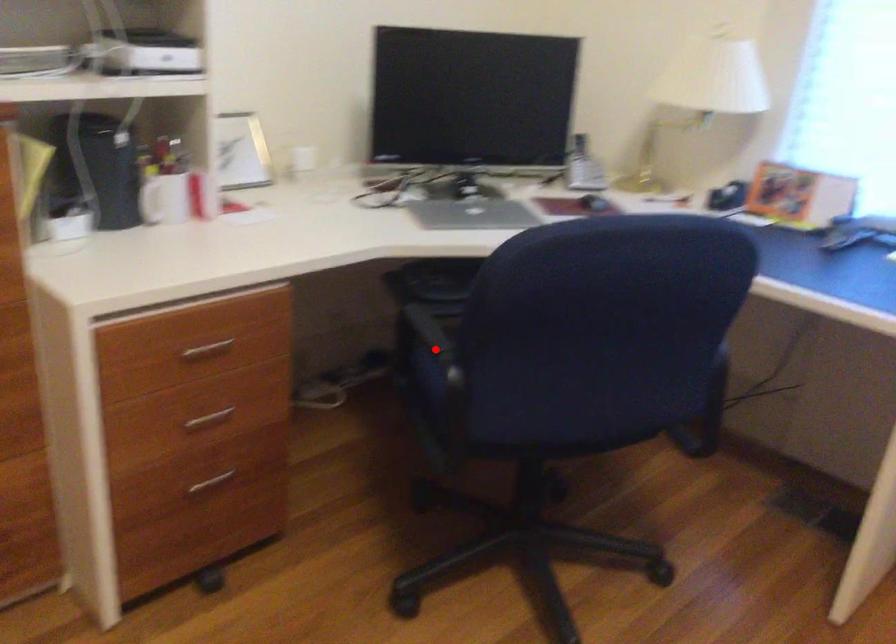
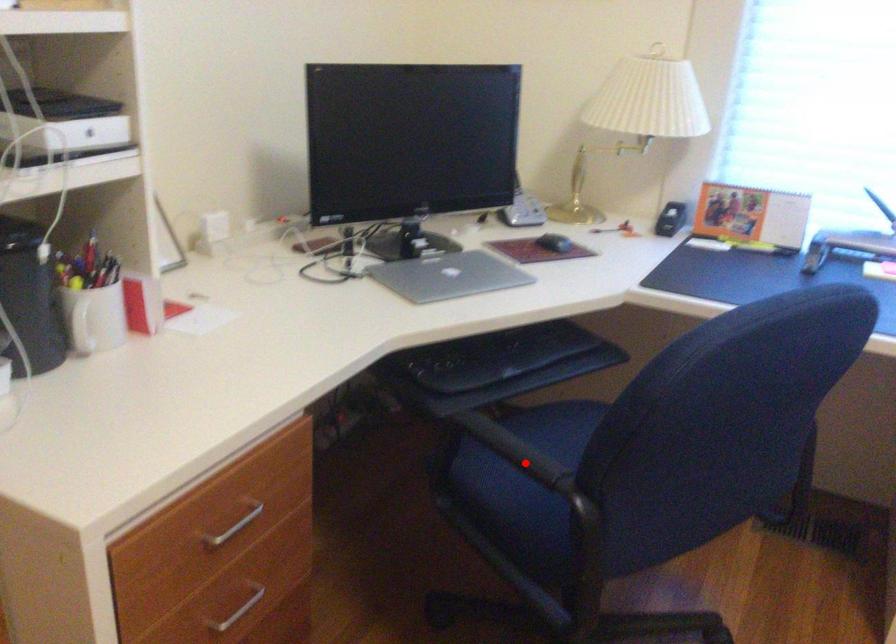
I am providing you with two images of the same scene from different viewpoints. A red point is marked on the first image and another point is marked on the second image. Do the highlighted points in image1 and image2 indicate the same real-world spot?

Yes